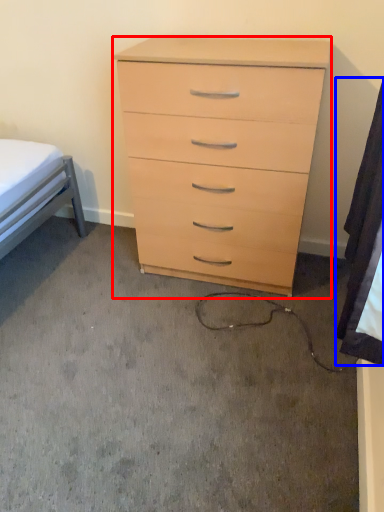
Question: Which point is closer to the camera, chest of drawers (highlighted by a red box) or sheet (highlighted by a blue box)?

Choices:
 (A) chest of drawers
 (B) sheet

Answer: (B)